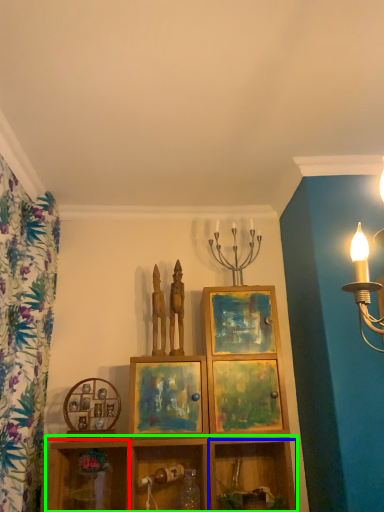
Question: Which object is the closest to the shelf (highlighted by a red box)? Choose among these: shelf (highlighted by a blue box) or shelf (highlighted by a green box).

Choices:
 (A) shelf
 (B) shelf

Answer: (B)